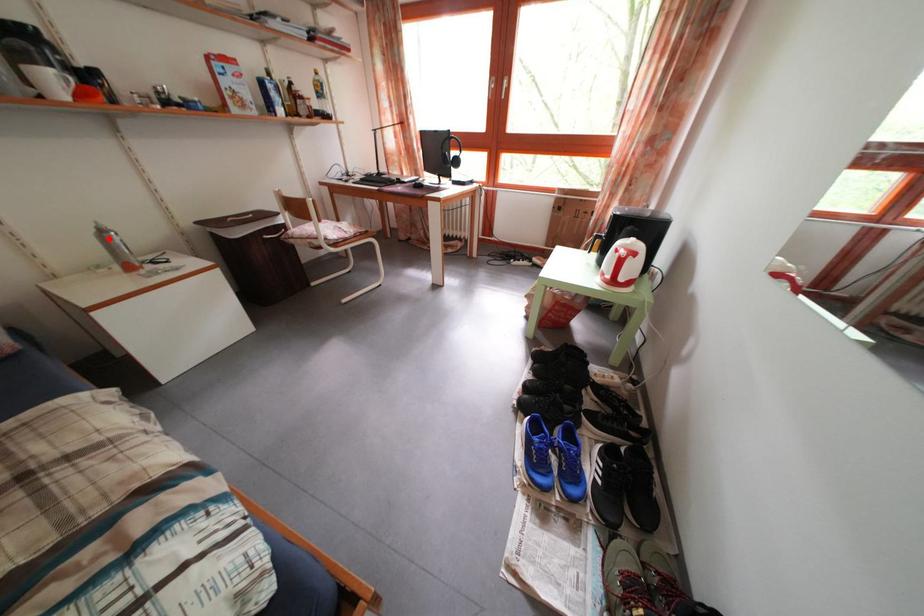
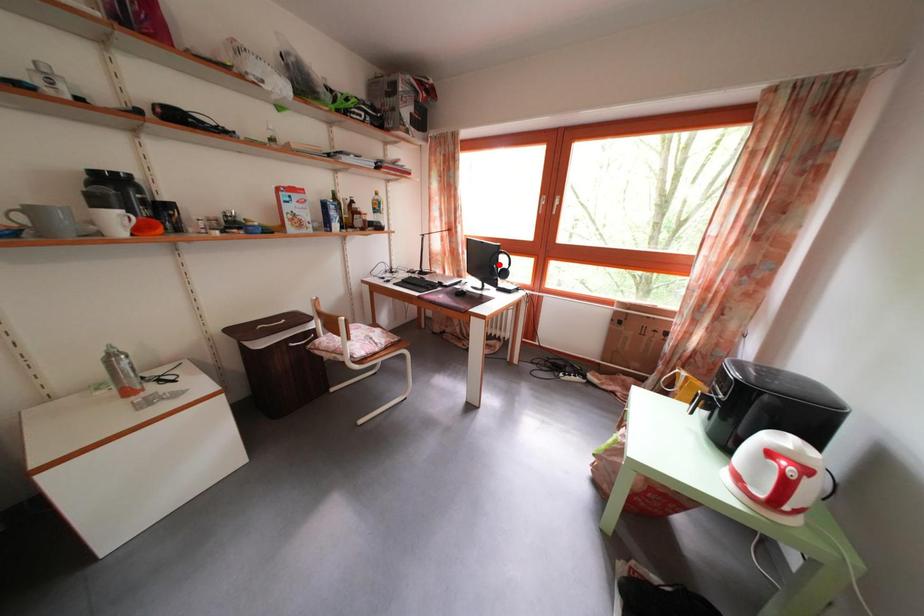
I am providing you with two images of the same scene from different viewpoints. A red point is marked on the first image and another point is marked on the second image. Is the red point in image1 aligned with the point shown in image2?

No